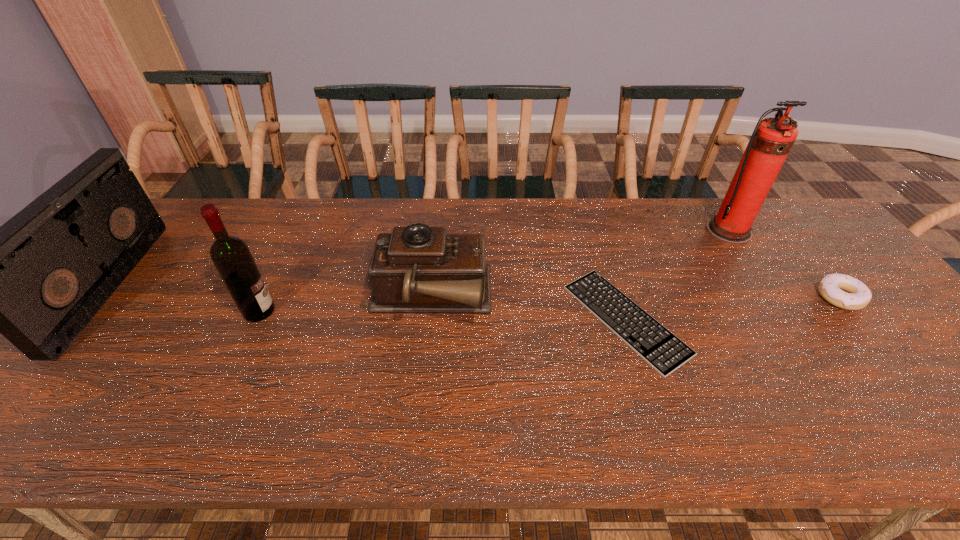
I want to click on fire extinguisher, so click(x=772, y=139).

Where is `the fifth object from left to right`? This screenshot has width=960, height=540. the fifth object from left to right is located at coordinates (772, 139).

The image size is (960, 540). I want to click on the second object from left to right, so click(x=231, y=256).

Find the location of `the third tallest object`. the third tallest object is located at coordinates (39, 279).

I want to click on the leftmost object, so click(39, 279).

Where is `the fourth object from right to left`? the fourth object from right to left is located at coordinates click(418, 269).

Where is `the fourth tallest object`? The width and height of the screenshot is (960, 540). the fourth tallest object is located at coordinates (418, 269).

Locate an element on the screen. This screenshot has height=540, width=960. doughnut is located at coordinates (846, 292).

Locate an element on the screen. This screenshot has width=960, height=540. the second shortest object is located at coordinates [x=846, y=292].

You are a GUI agent. You are given a task and a screenshot of the screen. Output one action in this format:
    pyautogui.click(x=<x>, y=<y>)
    Task: Click on the shortest object
    The height and width of the screenshot is (540, 960).
    Given the screenshot: What is the action you would take?
    pyautogui.click(x=659, y=347)